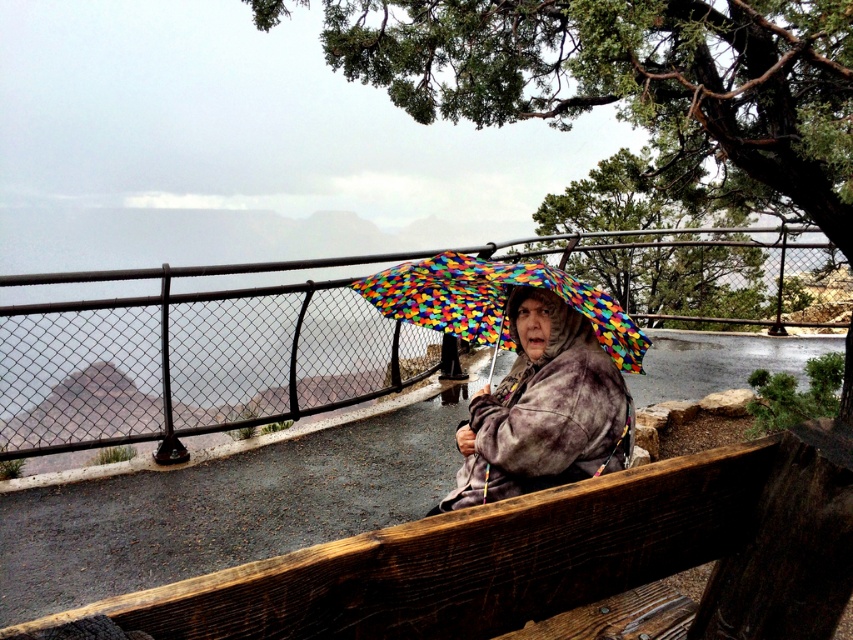
You are a delivery robot with a box that is 1.2 meters wide. You need to pass between the wooden bench at center and the multicolored fabric umbrella at center. Can you fit through the space between them?

The distance between the wooden bench at center and the multicolored fabric umbrella at center is 1.16 meters. Since the box is 1.2 meters wide, it is slightly wider than the available space. Therefore, the robot cannot fit through the space between them.

You are planning to take a photo of the wooden bench at center from the front. The green textured tree at upper center might block your view. Based on their sizes, which object would you need to move or adjust to ensure the bench is fully visible?

The green textured tree at upper center is larger in size than the wooden bench at center, so you would need to move or adjust the green textured tree at upper center to ensure the wooden bench at center is fully visible.